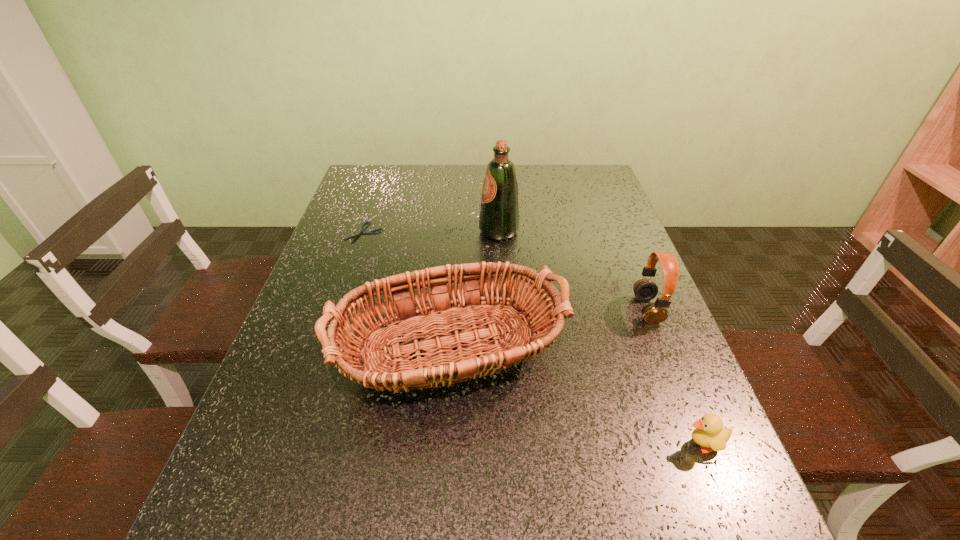
Find the location of `free spot that satisfies the following two spatial constraints: 1. on the front side of the second tallest object; 2. on the right side of the shears`. free spot that satisfies the following two spatial constraints: 1. on the front side of the second tallest object; 2. on the right side of the shears is located at coordinates (322, 357).

Where is `vacant space that satisfies the following two spatial constraints: 1. on the front-facing side of the olive oil; 2. on the front side of the shortest object`? Image resolution: width=960 pixels, height=540 pixels. vacant space that satisfies the following two spatial constraints: 1. on the front-facing side of the olive oil; 2. on the front side of the shortest object is located at coordinates (499, 233).